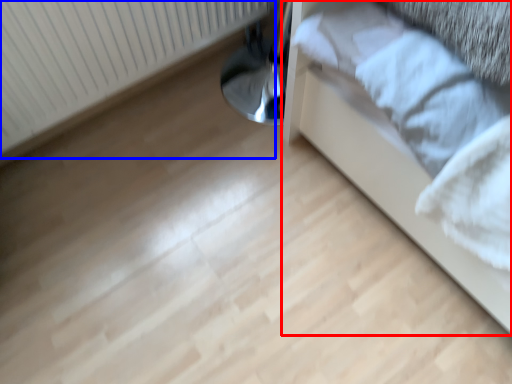
Question: Among these objects, which one is nearest to the camera, furniture (highlighted by a red box) or radiator (highlighted by a blue box)?

Choices:
 (A) furniture
 (B) radiator

Answer: (A)